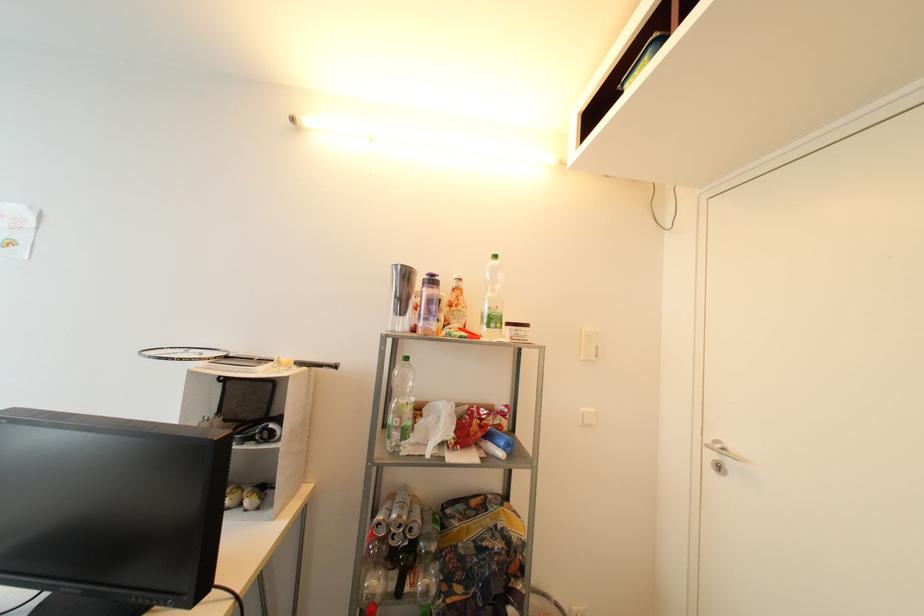
Locate an element on the screen. This screenshot has height=616, width=924. purple water bottle is located at coordinates (428, 305).